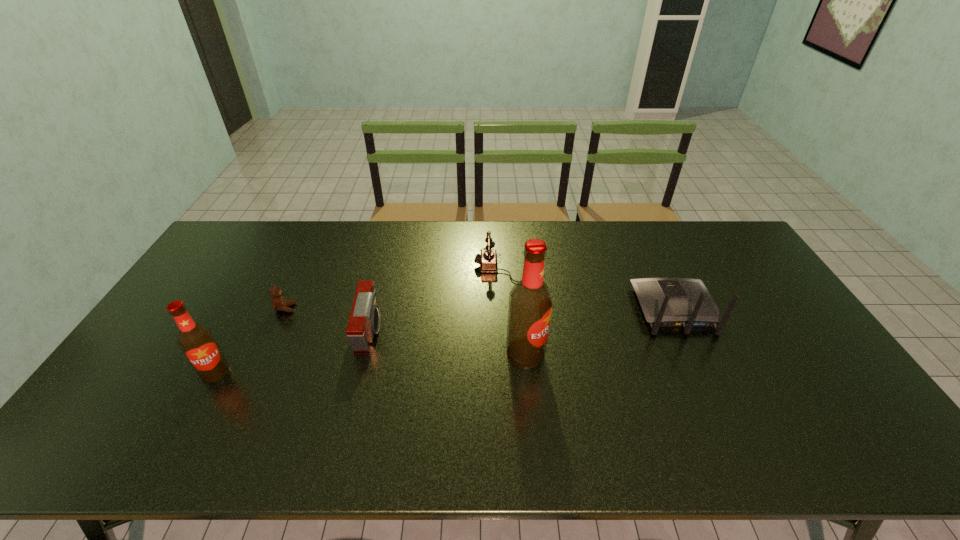
The image size is (960, 540). I want to click on vacant space that's between the fourth tallest object and the second object from left to right, so click(327, 320).

Locate an element on the screen. object identified as the second closest to the tallest object is located at coordinates (666, 302).

Identify which object is the fourth nearest to the telephone. Please provide its 2D coordinates. Your answer should be formatted as a tuple, i.e. [(x, y)], where the tuple contains the x and y coordinates of a point satisfying the conditions above.

[(279, 303)]

Image resolution: width=960 pixels, height=540 pixels. I want to click on free location that satisfies the following two spatial constraints: 1. on the front-facing side of the rightmost object; 2. on the dial of the telephone, so click(x=656, y=269).

I want to click on free region that satisfies the following two spatial constraints: 1. on the front-facing side of the right beer bottle; 2. on the left side of the third shortest object, so click(x=365, y=353).

The height and width of the screenshot is (540, 960). Identify the location of free space that satisfies the following two spatial constraints: 1. on the dial of the telephone; 2. on the front-facing side of the rightmost object. (509, 309).

Find the location of a particular element. This screenshot has height=540, width=960. vacant area that satisfies the following two spatial constraints: 1. on the front-facing side of the fourth shortest object; 2. on the dial of the telephone is located at coordinates (656, 269).

Locate an element on the screen. The height and width of the screenshot is (540, 960). free region that satisfies the following two spatial constraints: 1. on the back side of the taller beer bottle; 2. on the left side of the fifth shortest object is located at coordinates (226, 353).

You are a GUI agent. You are given a task and a screenshot of the screen. Output one action in this format:
    pyautogui.click(x=<x>, y=<y>)
    Task: Click on the blank space that satisfies the following two spatial constraints: 1. on the back side of the left beer bottle; 2. on the left side of the tallest object
    The width and height of the screenshot is (960, 540).
    Given the screenshot: What is the action you would take?
    pyautogui.click(x=226, y=353)

This screenshot has height=540, width=960. In order to click on vacant space that satisfies the following two spatial constraints: 1. on the front-facing side of the rightmost object; 2. on the dial of the telephone in this screenshot , I will do `click(656, 269)`.